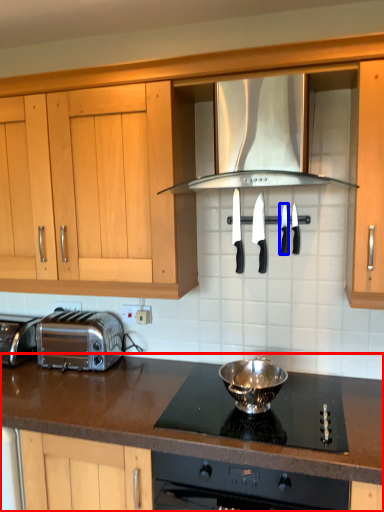
Question: Which point is closer to the camera, countertop (highlighted by a red box) or kitchen appliance (highlighted by a blue box)?

Choices:
 (A) countertop
 (B) kitchen appliance

Answer: (A)